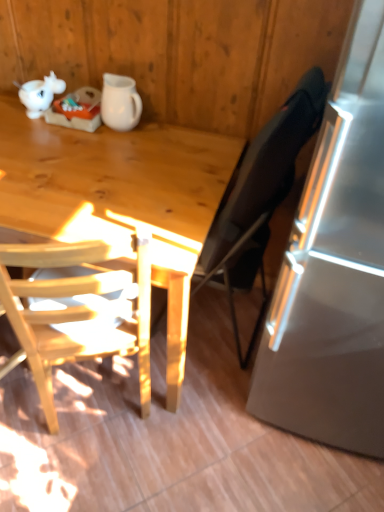
You are a GUI agent. You are given a task and a screenshot of the screen. Output one action in this format:
    pyautogui.click(x=<x>, y=<y>)
    Task: Click on the vacant space to the right of white matte pitcher at upper center
    
    Given the screenshot: What is the action you would take?
    pyautogui.click(x=165, y=129)